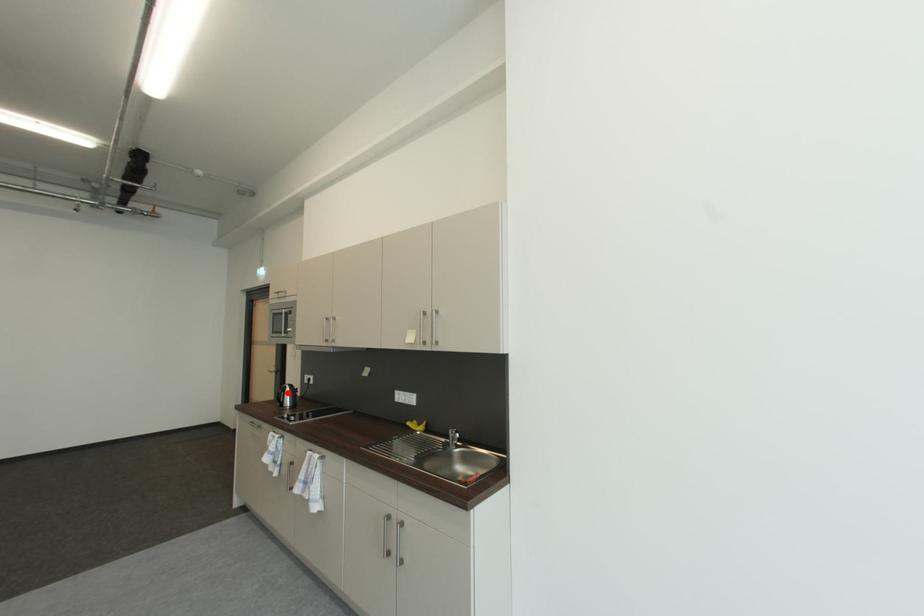
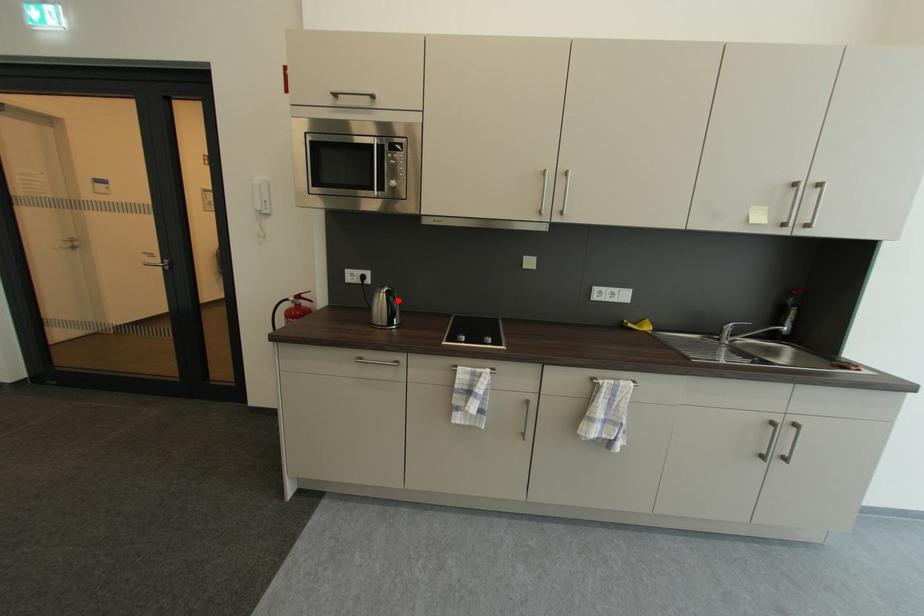
I am providing you with two images of the same scene from different viewpoints. A red point is marked on the first image and another point is marked on the second image. Does the point marked in image1 correspond to the same location as the one in image2?

Yes